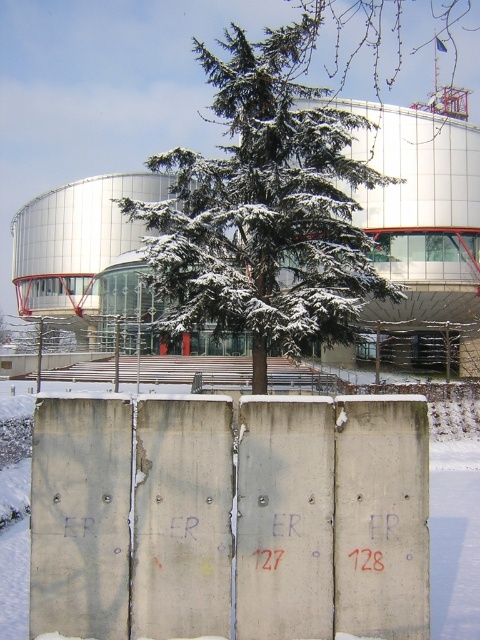
Is concrete textured barrier at center taller than snow-covered evergreen at center?

In fact, concrete textured barrier at center may be shorter than snow-covered evergreen at center.

Who is more distant from viewer, (228, 492) or (192, 216)?

Positioned behind is point (192, 216).

In order to click on concrete textured barrier at center in this screenshot , I will do `click(252, 522)`.